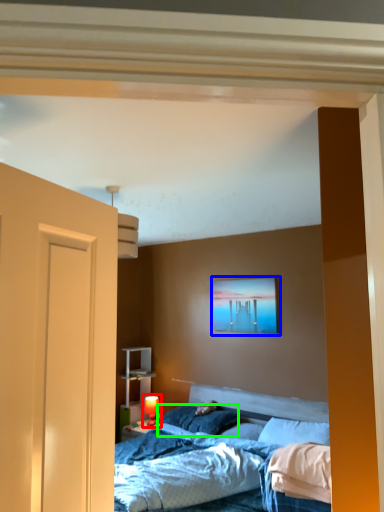
Question: Considering the real-world distances, which object is farthest from table lamp (highlighted by a red box)? picture frame (highlighted by a blue box) or pillow (highlighted by a green box)?

Choices:
 (A) picture frame
 (B) pillow

Answer: (A)